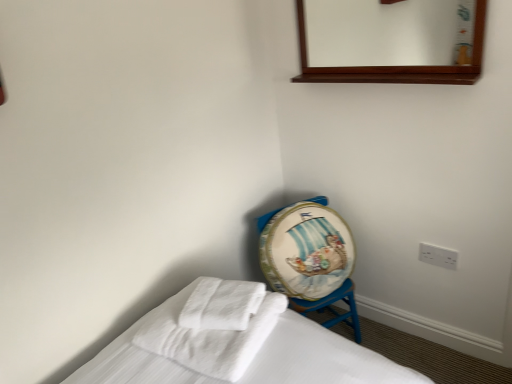
Locate an element on the screen. empty space that is ontop of white soft towel at lower left, the 1th bath towel in the left-to-right sequence (from a real-world perspective) is located at coordinates (213, 322).